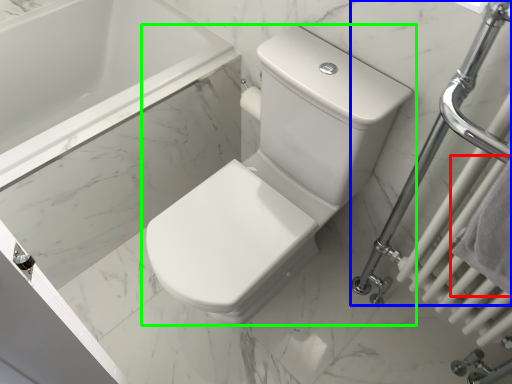
Question: Which object is the closest to the bath towel (highlighted by a red box)? Choose among these: shower (highlighted by a blue box) or toilet (highlighted by a green box).

Choices:
 (A) shower
 (B) toilet

Answer: (A)